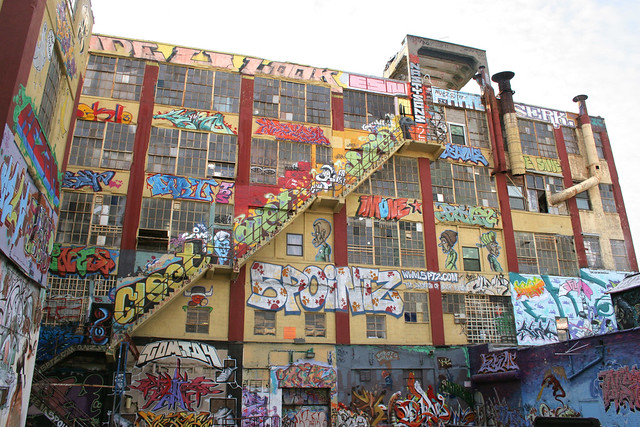
Find the location of a particular element. The image size is (640, 427). 2nd row of stairs is located at coordinates (57, 352).